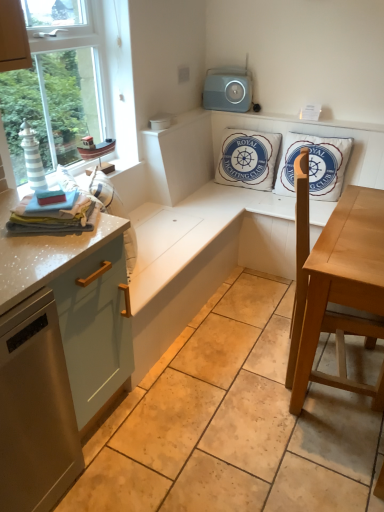
Question: From a real-world perspective, is white cotton cushion at upper center, which is the 1th pillow in left-to-right order, on top of gray plastic speaker at upper center?

Choices:
 (A) yes
 (B) no

Answer: (B)

Question: Is white cotton cushion at upper center, which is the 1th pillow in left-to-right order, positioned in front of gray plastic speaker at upper center?

Choices:
 (A) no
 (B) yes

Answer: (B)

Question: From a real-world perspective, does white cotton cushion at upper center, which is counted as the second pillow, starting from the right, sit lower than gray plastic speaker at upper center?

Choices:
 (A) no
 (B) yes

Answer: (B)

Question: Is white cotton cushion at upper center, which is counted as the second pillow, starting from the right, taller than gray plastic speaker at upper center?

Choices:
 (A) yes
 (B) no

Answer: (A)

Question: Would you say white cotton cushion at upper center, which is the 1th pillow in left-to-right order, contains gray plastic speaker at upper center?

Choices:
 (A) yes
 (B) no

Answer: (B)

Question: Is matte light blue cabinet at left bigger or smaller than light brown wooden table at center?

Choices:
 (A) big
 (B) small

Answer: (B)

Question: Based on their positions, is matte light blue cabinet at left located to the left or right of light brown wooden table at center?

Choices:
 (A) left
 (B) right

Answer: (A)

Question: Is point (102, 401) closer or farther from the camera than point (309, 337)?

Choices:
 (A) farther
 (B) closer

Answer: (A)

Question: Is matte light blue cabinet at left spatially inside light brown wooden table at center, or outside of it?

Choices:
 (A) inside
 (B) outside

Answer: (B)

Question: From the image's perspective, is gray plastic speaker at upper center located above or below matte light blue cabinet at left?

Choices:
 (A) below
 (B) above

Answer: (B)

Question: Is gray plastic speaker at upper center to the left or to the right of matte light blue cabinet at left in the image?

Choices:
 (A) left
 (B) right

Answer: (B)

Question: Considering the positions of gray plastic speaker at upper center and matte light blue cabinet at left in the image, is gray plastic speaker at upper center wider or thinner than matte light blue cabinet at left?

Choices:
 (A) thin
 (B) wide

Answer: (A)

Question: In terms of size, does gray plastic speaker at upper center appear bigger or smaller than matte light blue cabinet at left?

Choices:
 (A) big
 (B) small

Answer: (B)

Question: Is satin silver dishwasher at lower left situated inside white cotton cushion at upper center, which is the 1th pillow in left-to-right order, or outside?

Choices:
 (A) outside
 (B) inside

Answer: (A)

Question: From the image's perspective, is satin silver dishwasher at lower left above or below white cotton cushion at upper center, which is the 1th pillow in left-to-right order?

Choices:
 (A) below
 (B) above

Answer: (A)